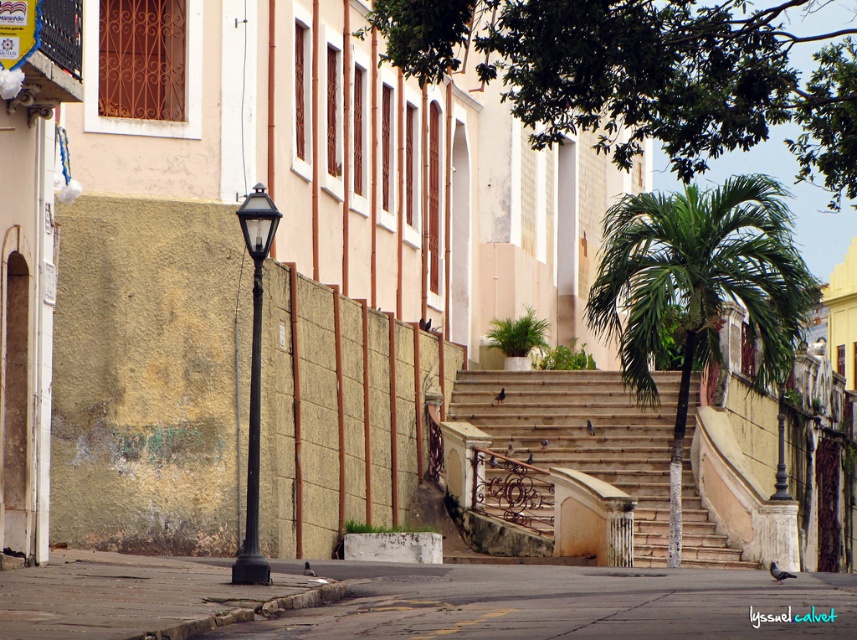
Question: Which object is farther from the camera taking this photo?

Choices:
 (A) green leafy palm tree at center
 (B) black metal/texture lamp post at left
 (C) stone stairs at center
 (D) gray concrete pavement at lower left

Answer: (C)

Question: Which point is closer to the camera taking this photo?

Choices:
 (A) (262, 227)
 (B) (612, 272)

Answer: (A)

Question: Considering the relative positions of stone stairs at center and black metal/texture lamp post at left in the image provided, where is stone stairs at center located with respect to black metal/texture lamp post at left?

Choices:
 (A) above
 (B) below

Answer: (B)

Question: Which of these objects is positioned farthest from the gray concrete pavement at lower left?

Choices:
 (A) stone stairs at center
 (B) black metal/texture lamp post at left

Answer: (A)

Question: In this image, where is gray concrete pavement at lower left located relative to black metal/texture lamp post at left?

Choices:
 (A) above
 (B) below

Answer: (B)

Question: Can you confirm if gray concrete pavement at lower left is positioned below green leafy palm tree at center?

Choices:
 (A) yes
 (B) no

Answer: (A)